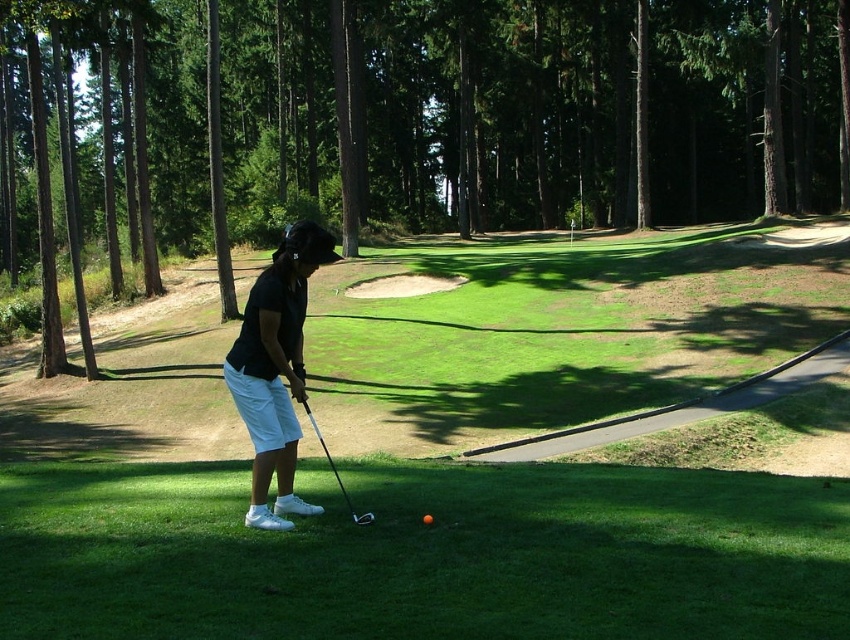
Question: Observing the image, what is the correct spatial positioning of white cotton shorts at center in reference to metallic silver golf club at center?

Choices:
 (A) right
 (B) left

Answer: (B)

Question: Which point is farther to the camera?

Choices:
 (A) orange matte golf ball at center
 (B) white cotton shorts at center
 (C) metallic silver golf club at center
 (D) green grass at center

Answer: (A)

Question: Does metallic silver golf club at center have a smaller size compared to orange matte golf ball at center?

Choices:
 (A) yes
 (B) no

Answer: (B)

Question: Which object is positioned farthest from the metallic silver golf club at center?

Choices:
 (A) orange matte golf ball at center
 (B) green grass at center
 (C) white cotton shorts at center

Answer: (B)

Question: Where is green grass at center located in relation to metallic silver golf club at center in the image?

Choices:
 (A) below
 (B) above

Answer: (B)

Question: Considering the real-world distances, which object is closest to the green grass at center?

Choices:
 (A) white cotton shorts at center
 (B) metallic silver golf club at center
 (C) orange matte golf ball at center

Answer: (A)